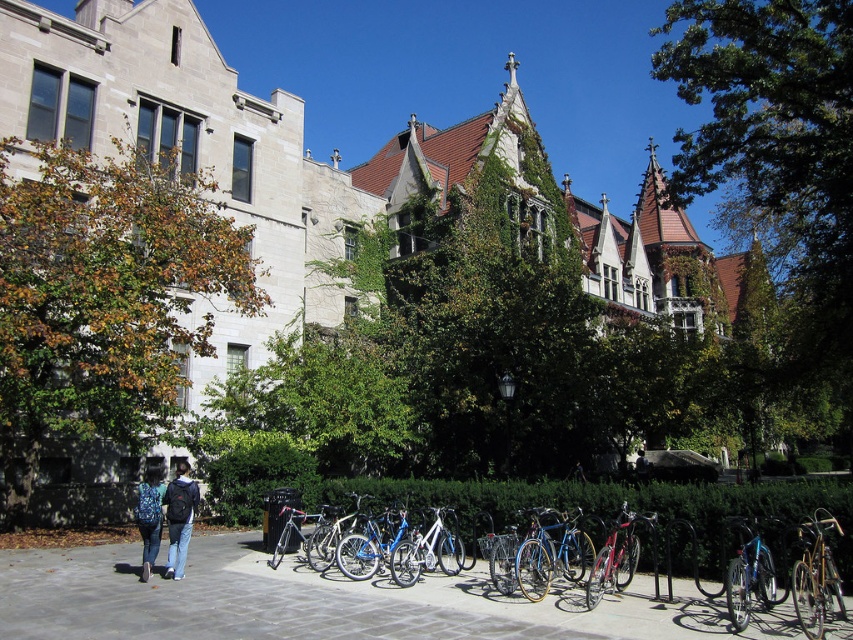
Question: Is green leafy tree at left positioned before silver metallic bicycle at center?

Choices:
 (A) no
 (B) yes

Answer: (B)

Question: Which of the following is the farthest from the observer?

Choices:
 (A) dark blue jeans at lower left
 (B) dark blue jeans at center

Answer: (B)

Question: Which point is farther to the camera?

Choices:
 (A) (350, 534)
 (B) (780, 204)
 (C) (805, 576)

Answer: (B)

Question: Which point is closer to the camera taking this photo?

Choices:
 (A) (100, 204)
 (B) (798, 605)
 (C) (294, 525)

Answer: (B)

Question: Is shiny blue bike at center closer to camera compared to shiny blue bicycle at lower right?

Choices:
 (A) yes
 (B) no

Answer: (B)

Question: Can you confirm if green leafy tree at upper right is wider than denim jacket at lower left?

Choices:
 (A) no
 (B) yes

Answer: (B)